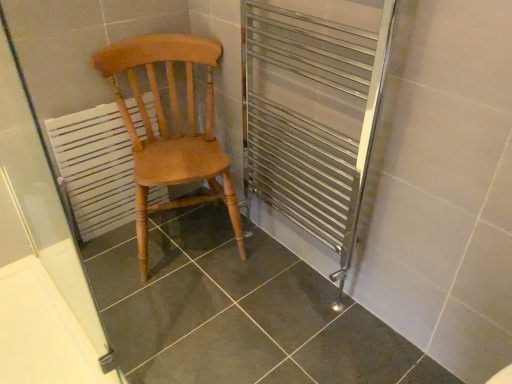
Where is `free area in between light brown wood chair at center and white painted wood radiator at left`? free area in between light brown wood chair at center and white painted wood radiator at left is located at coordinates (111, 253).